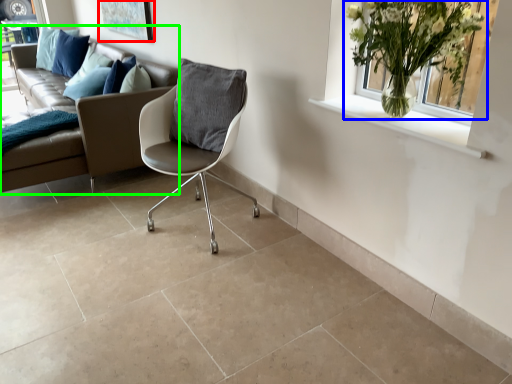
Question: Which object is positioned farthest from picture frame (highlighted by a red box)? Select from houseplant (highlighted by a blue box) and studio couch (highlighted by a green box).

Choices:
 (A) houseplant
 (B) studio couch

Answer: (A)